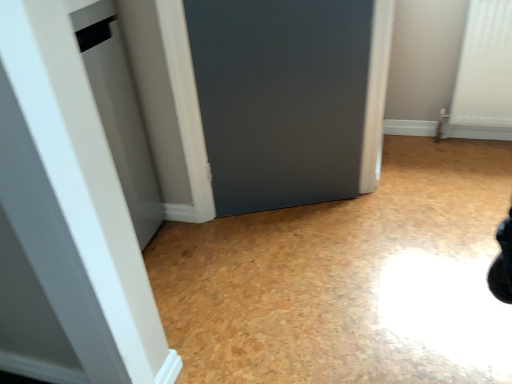
Describe the element at coordinates (66, 217) in the screenshot. I see `white glossy door at left` at that location.

The height and width of the screenshot is (384, 512). Find the location of `white glossy door at left`. white glossy door at left is located at coordinates (66, 217).

Identify the location of white glossy door at left. (66, 217).